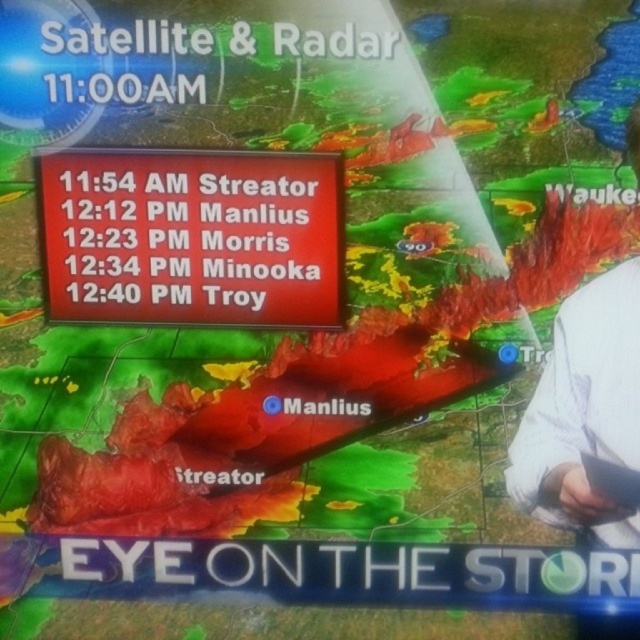
Who is higher up, red matte sign at center or white fabric shirt at right?

red matte sign at center is higher up.

This screenshot has width=640, height=640. What do you see at coordinates (193, 236) in the screenshot? I see `red matte sign at center` at bounding box center [193, 236].

Is point (61, 205) positioned behind point (636, 285)?

Yes, it is behind point (636, 285).

The width and height of the screenshot is (640, 640). I want to click on red matte sign at center, so click(193, 236).